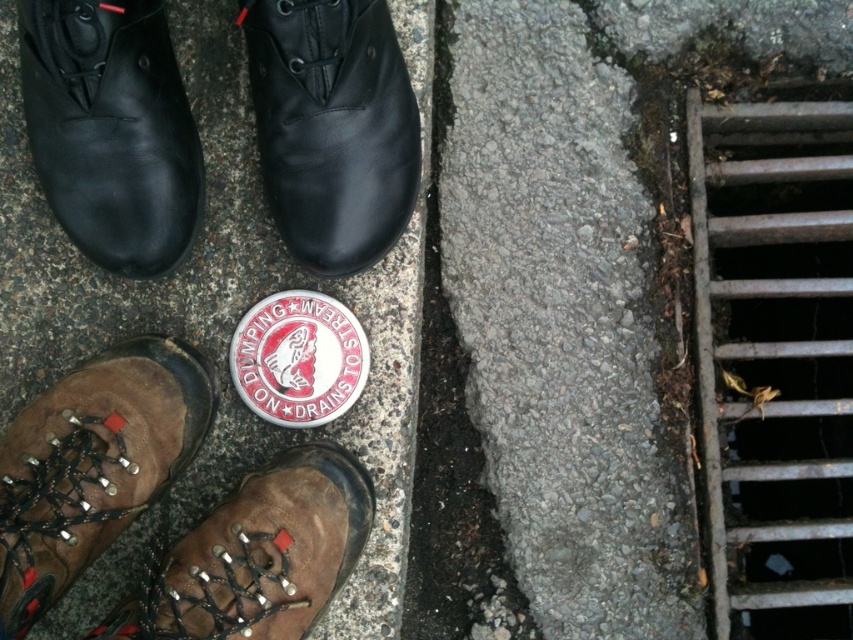
Question: Based on their relative distances, which object is nearer to the brown leather boot at lower left?

Choices:
 (A) black leather shoe at upper left
 (B) black leather shoe at upper center

Answer: (A)

Question: Can you confirm if gray concrete pavement at center is positioned above brown leather boot at lower left?

Choices:
 (A) yes
 (B) no

Answer: (A)

Question: Which is farther from the gray concrete pavement at center?

Choices:
 (A) black leather shoe at upper left
 (B) brown leather boot at lower left
 (C) brown leather shoe at lower left
 (D) black leather shoe at upper center

Answer: (D)

Question: Is black leather shoe at upper center positioned at the back of brown leather shoe at lower left?

Choices:
 (A) yes
 (B) no

Answer: (A)

Question: Is black leather shoe at upper center bigger than brown leather shoe at lower left?

Choices:
 (A) yes
 (B) no

Answer: (A)

Question: Among these points, which one is nearest to the camera?

Choices:
 (A) (300, 224)
 (B) (178, 257)

Answer: (A)